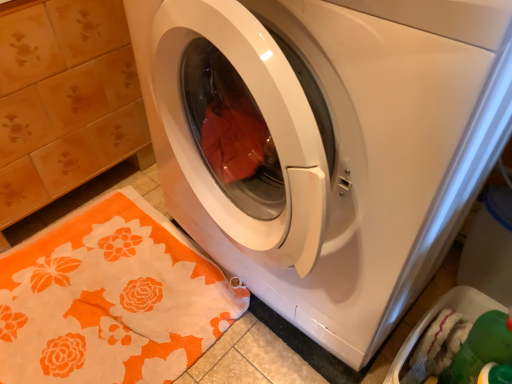
Question: Is orange floral rug at lower left wider than green plastic dish washer at lower right?

Choices:
 (A) yes
 (B) no

Answer: (A)

Question: Is orange floral rug at lower left positioned beyond the bounds of green plastic dish washer at lower right?

Choices:
 (A) yes
 (B) no

Answer: (A)

Question: From the image's perspective, is orange floral rug at lower left located beneath green plastic dish washer at lower right?

Choices:
 (A) no
 (B) yes

Answer: (B)

Question: From a real-world perspective, is orange floral rug at lower left over green plastic dish washer at lower right?

Choices:
 (A) no
 (B) yes

Answer: (A)

Question: Does orange floral rug at lower left lie behind green plastic dish washer at lower right?

Choices:
 (A) no
 (B) yes

Answer: (B)

Question: Considering the positions of white glossy washing machine at center and orange floral rug at lower left in the image, is white glossy washing machine at center bigger or smaller than orange floral rug at lower left?

Choices:
 (A) small
 (B) big

Answer: (B)

Question: From a real-world perspective, is white glossy washing machine at center above or below orange floral rug at lower left?

Choices:
 (A) above
 (B) below

Answer: (A)

Question: Would you say white glossy washing machine at center is inside or outside orange floral rug at lower left?

Choices:
 (A) inside
 (B) outside

Answer: (B)

Question: From the image's perspective, is white glossy washing machine at center positioned above or below orange floral rug at lower left?

Choices:
 (A) above
 (B) below

Answer: (A)

Question: Is white glossy washing machine at center taller or shorter than green plastic dish washer at lower right?

Choices:
 (A) tall
 (B) short

Answer: (A)

Question: From a real-world perspective, is white glossy washing machine at center physically located above or below green plastic dish washer at lower right?

Choices:
 (A) below
 (B) above

Answer: (B)

Question: In terms of width, does white glossy washing machine at center look wider or thinner when compared to green plastic dish washer at lower right?

Choices:
 (A) wide
 (B) thin

Answer: (A)

Question: Considering the positions of white glossy washing machine at center and green plastic dish washer at lower right in the image, is white glossy washing machine at center bigger or smaller than green plastic dish washer at lower right?

Choices:
 (A) big
 (B) small

Answer: (A)

Question: From the image's perspective, is green plastic dish washer at lower right located above or below orange floral rug at lower left?

Choices:
 (A) below
 (B) above

Answer: (B)

Question: In terms of size, does green plastic dish washer at lower right appear bigger or smaller than orange floral rug at lower left?

Choices:
 (A) big
 (B) small

Answer: (B)